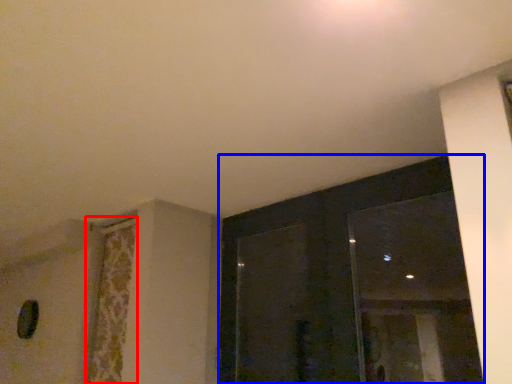
Question: Which point is closer to the camera, curtain (highlighted by a red box) or window (highlighted by a blue box)?

Choices:
 (A) curtain
 (B) window

Answer: (B)